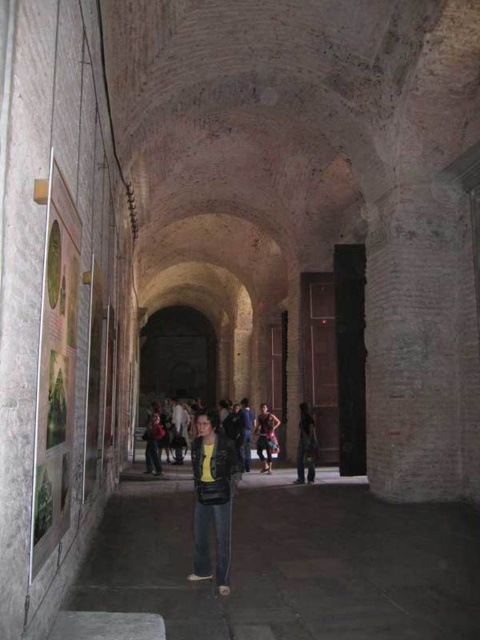
Question: Estimate the real-world distances between objects in this image. Which object is closer to the multicolored fabric pants at center?

Choices:
 (A) leather jacket at center
 (B) dark blue jeans at center
 (C) denim jeans at center

Answer: (B)

Question: Is denim jeans at center closer to the viewer compared to multicolored fabric pants at center?

Choices:
 (A) yes
 (B) no

Answer: (A)

Question: Is leather jacket at center to the right of dark blue jeans at center from the viewer's perspective?

Choices:
 (A) yes
 (B) no

Answer: (B)

Question: Among these points, which one is farthest from the camera?

Choices:
 (A) (203, 426)
 (B) (263, 452)

Answer: (B)

Question: Is leather jacket at center above dark blue jeans at center?

Choices:
 (A) no
 (B) yes

Answer: (B)

Question: Among these objects, which one is farthest from the camera?

Choices:
 (A) leather jacket at center
 (B) multicolored fabric pants at center
 (C) dark blue jeans at center

Answer: (B)